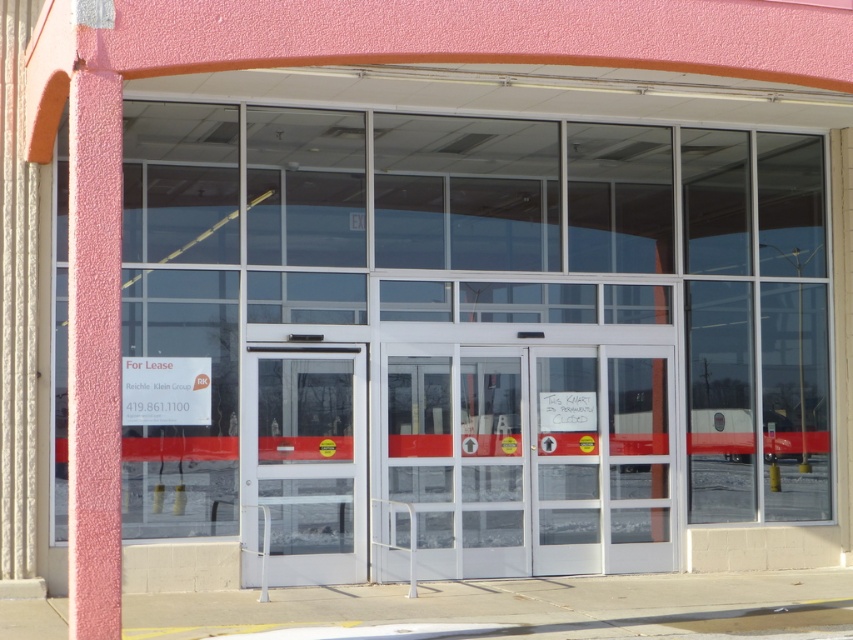
You are a delivery person trying to enter the building through the transparent glass door at center. The pink textured pillar at left is blocking your path. Can you walk around it to reach the door?

The pink textured pillar at left is much taller than the transparent glass door at center, so it might block your path. However, since pillars are typically solid structures, you would need to go around it to reach the transparent glass door at center.